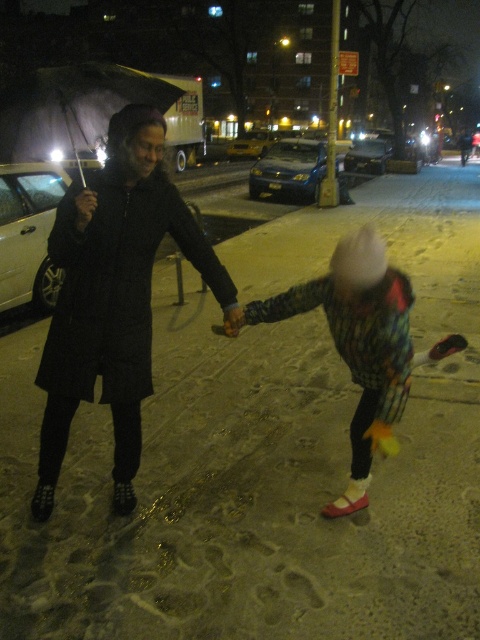
You are a photographer trying to capture the two people in the scene. You want to ensure that both the black textured coat at left and the transparent plastic umbrella at upper left are clearly visible in your shot. Given their relative heights, which object should you focus on first to ensure proper focus?

The transparent plastic umbrella at upper left is taller than the black textured coat at left, so focusing on the taller object first would help ensure both are in focus.

You are a pedestrian trying to cross the street and see the transparent plastic umbrella at upper left and the metallic blue sedan at center. Which object is closer to the street?

The metallic blue sedan at center is closer to the street because the transparent plastic umbrella at upper left is positioned under it, indicating it is further away from the street.